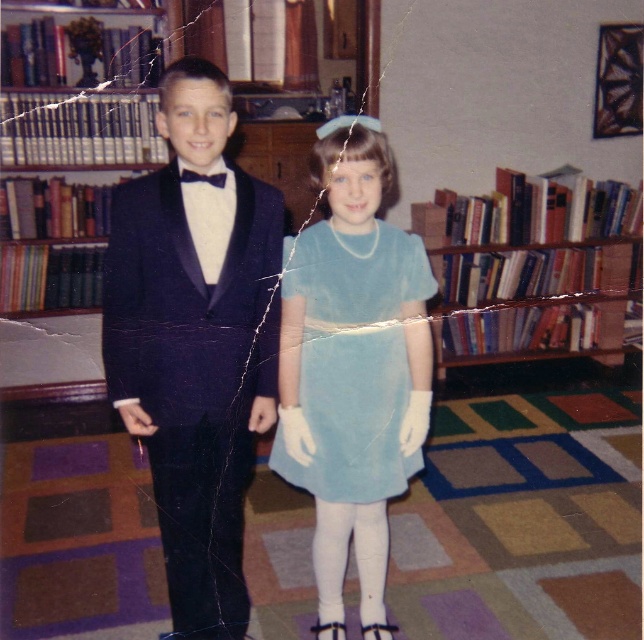
Question: Considering the real-world distances, which object is farthest from the shiny dark blue tuxedo at center?

Choices:
 (A) black satin bow tie at upper center
 (B) light blue satin dress at center
 (C) blue hardcover books at center

Answer: (C)

Question: In this image, where is blue hardcover books at center located relative to black satin bow tie at upper center?

Choices:
 (A) above
 (B) below

Answer: (B)

Question: Which of these objects is positioned farthest from the blue hardcover books at center?

Choices:
 (A) light blue satin dress at center
 (B) green hardcover books at left

Answer: (A)

Question: Which point is farther from the camera taking this photo?

Choices:
 (A) (317, 492)
 (B) (50, 44)
 (C) (162, 355)
 (D) (204, 177)

Answer: (B)

Question: Can you confirm if shiny dark blue tuxedo at center is thinner than green hardcover books at left?

Choices:
 (A) no
 (B) yes

Answer: (B)

Question: Does shiny dark blue tuxedo at center appear over green hardcover books at left?

Choices:
 (A) yes
 (B) no

Answer: (B)